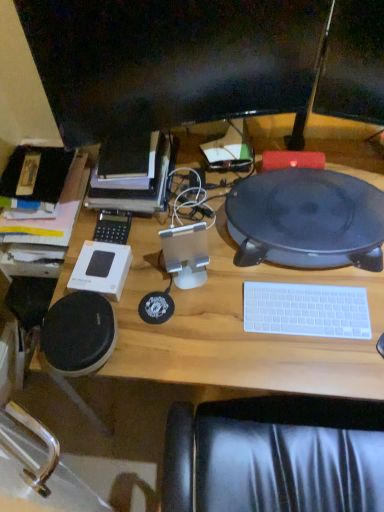
The width and height of the screenshot is (384, 512). In order to click on free spot above matte black tablet at center (from a real-world perspective) in this screenshot , I will do [307, 204].